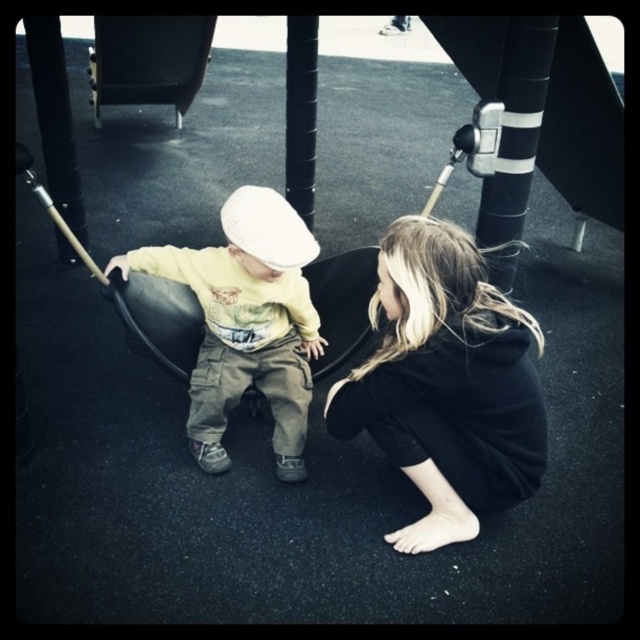
Question: Is black soft hair at lower center smaller than matte yellow shirt at center?

Choices:
 (A) no
 (B) yes

Answer: (B)

Question: Is black soft hair at lower center thinner than matte yellow shirt at center?

Choices:
 (A) yes
 (B) no

Answer: (A)

Question: Which of the following is the farthest from the observer?

Choices:
 (A) (300, 273)
 (B) (458, 392)

Answer: (A)

Question: Which of the following is the farthest from the observer?

Choices:
 (A) matte yellow shirt at center
 (B) black soft hair at lower center

Answer: (A)

Question: Is black soft hair at lower center above matte yellow shirt at center?

Choices:
 (A) yes
 (B) no

Answer: (B)